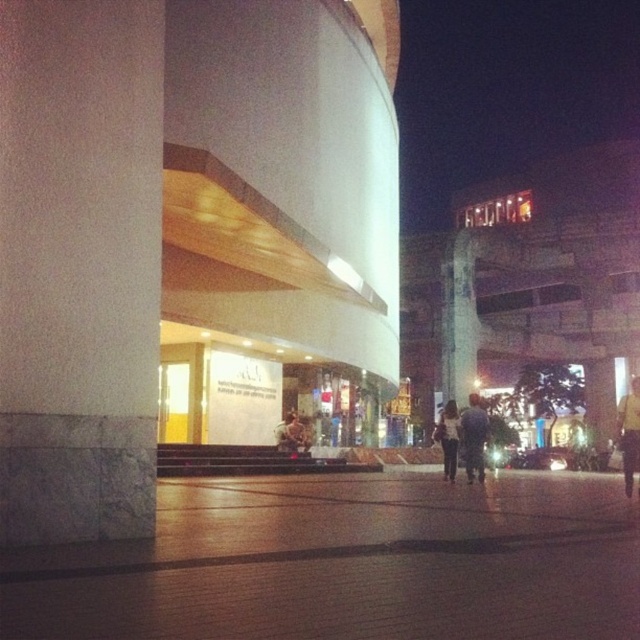
Question: Can you confirm if brown brick pavement at center is wider than white marble pillar at left?

Choices:
 (A) yes
 (B) no

Answer: (A)

Question: Which point appears closest to the camera in this image?

Choices:
 (A) (456, 403)
 (B) (122, 460)
 (C) (285, 429)

Answer: (B)

Question: Considering the real-world distances, which object is closest to the light brown leather jacket at center?

Choices:
 (A) white matte shirt at center
 (B) dark blue jeans at center
 (C) white marble pillar at left
 (D) yellow fabric shirt at right

Answer: (A)

Question: Is brown brick pavement at center positioned before white marble pillar at left?

Choices:
 (A) yes
 (B) no

Answer: (A)

Question: Which of the following is the closest to the observer?

Choices:
 (A) (154, 444)
 (B) (456, 410)
 (C) (301, 432)
 (D) (480, 456)

Answer: (A)

Question: Where is dark blue jeans at center located in relation to light brown leather jacket at center in the image?

Choices:
 (A) above
 (B) below

Answer: (B)